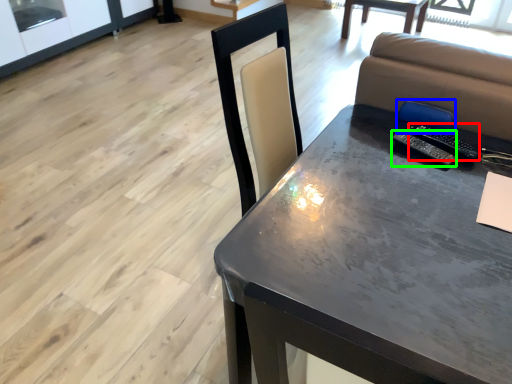
Question: Based on their relative distances, which object is farther from remote (highlighted by a red box)? Choose from armchair (highlighted by a blue box) and remote (highlighted by a green box).

Choices:
 (A) armchair
 (B) remote

Answer: (B)